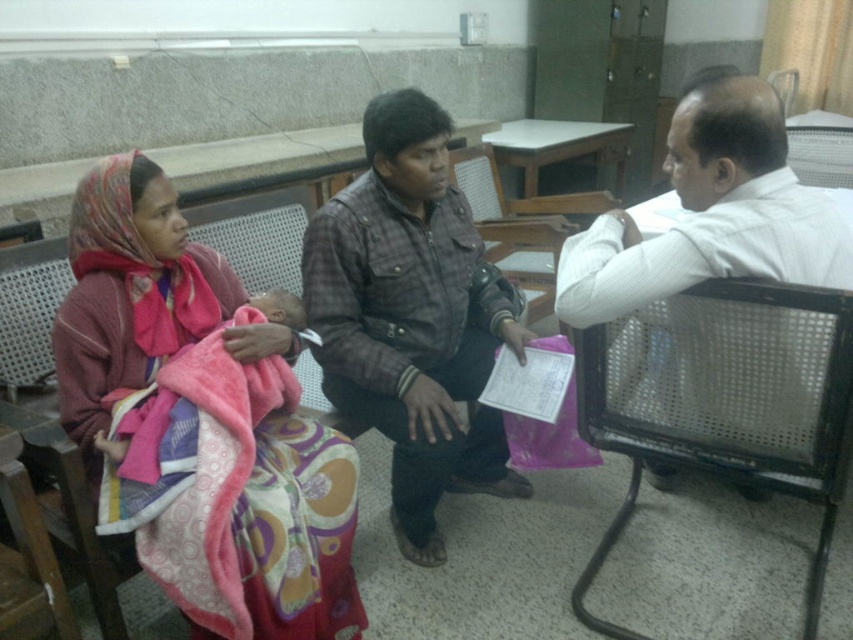
Question: Which object is positioned farthest from the matte pink blanket at left?

Choices:
 (A) metal mesh chair at right
 (B) white shirt at right
 (C) plaid fabric shirt at center
 (D) pink soft blanket at center

Answer: (B)

Question: Does matte pink blanket at left have a lesser width compared to white shirt at right?

Choices:
 (A) no
 (B) yes

Answer: (A)

Question: Which point is farther to the camera?

Choices:
 (A) wooden mesh chair at center
 (B) matte pink blanket at left
 (C) pink soft blanket at center

Answer: (A)

Question: Is matte pink blanket at left bigger than white shirt at right?

Choices:
 (A) no
 (B) yes

Answer: (B)

Question: Which point is closer to the camera taking this photo?

Choices:
 (A) (86, 396)
 (B) (352, 189)
 (C) (651, 284)

Answer: (C)

Question: Does white shirt at right lie behind wooden mesh chair at center?

Choices:
 (A) no
 (B) yes

Answer: (A)